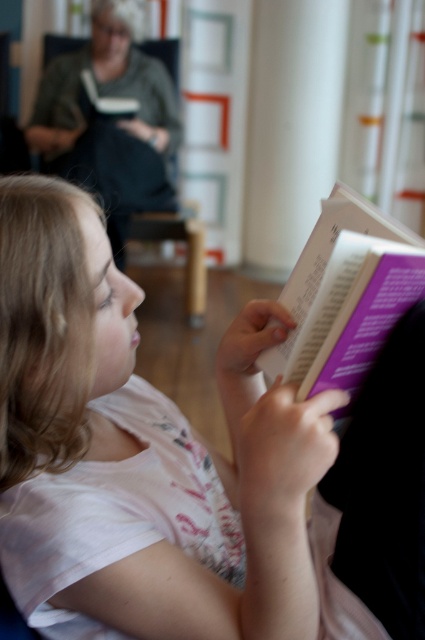
The height and width of the screenshot is (640, 425). Describe the element at coordinates (345, 294) in the screenshot. I see `purple paper book at center` at that location.

Between point (325, 243) and point (48, 141), which one is positioned behind?

The point (48, 141) is more distant.

Locate an element on the screen. This screenshot has height=640, width=425. purple paper book at center is located at coordinates (345, 294).

Between white cotton shirt at center and purple paper book at center, which one appears on the right side from the viewer's perspective?

From the viewer's perspective, purple paper book at center appears more on the right side.

Can you confirm if white cotton shirt at center is positioned to the right of purple paper book at center?

Incorrect, white cotton shirt at center is not on the right side of purple paper book at center.

Who is more distant from viewer, (53, 624) or (345, 378)?

Positioned behind is point (53, 624).

Identify the location of white cotton shirt at center. The image size is (425, 640). (139, 452).

Who is positioned more to the right, white cotton shirt at center or green fabric sweater at upper left?

From the viewer's perspective, white cotton shirt at center appears more on the right side.

What do you see at coordinates (139, 452) in the screenshot? I see `white cotton shirt at center` at bounding box center [139, 452].

Who is more forward, (30, 196) or (34, 145)?

Point (30, 196) is more forward.

This screenshot has width=425, height=640. I want to click on white cotton shirt at center, so click(x=139, y=452).